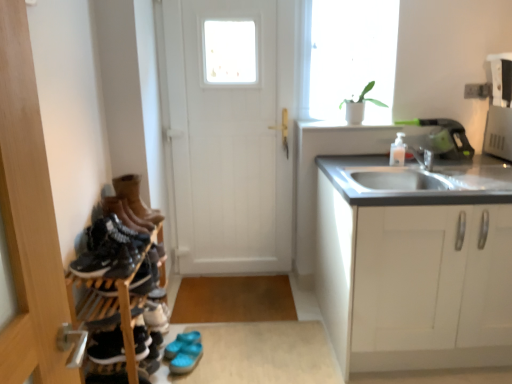
Where is `empty space that is to the right of blue rubber sandals at lower center, which is counted as the first footwear, starting from the bottom`? The height and width of the screenshot is (384, 512). empty space that is to the right of blue rubber sandals at lower center, which is counted as the first footwear, starting from the bottom is located at coordinates (219, 354).